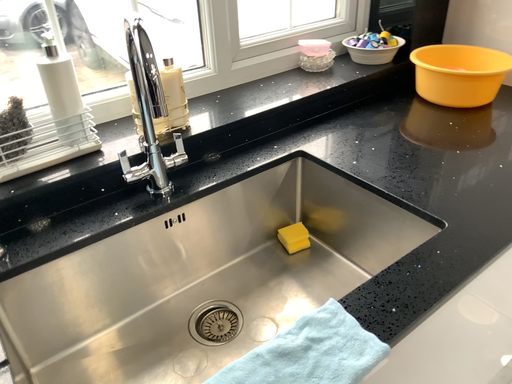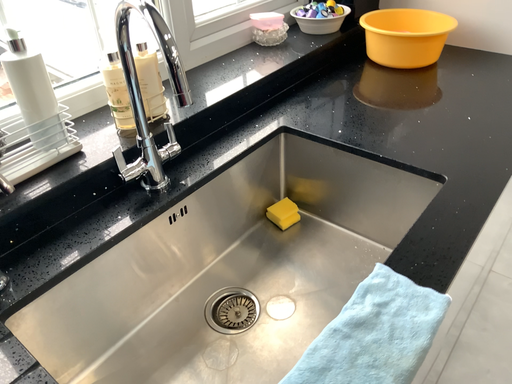
Question: Which way did the camera rotate in the video?

Choices:
 (A) rotated left
 (B) rotated right

Answer: (B)